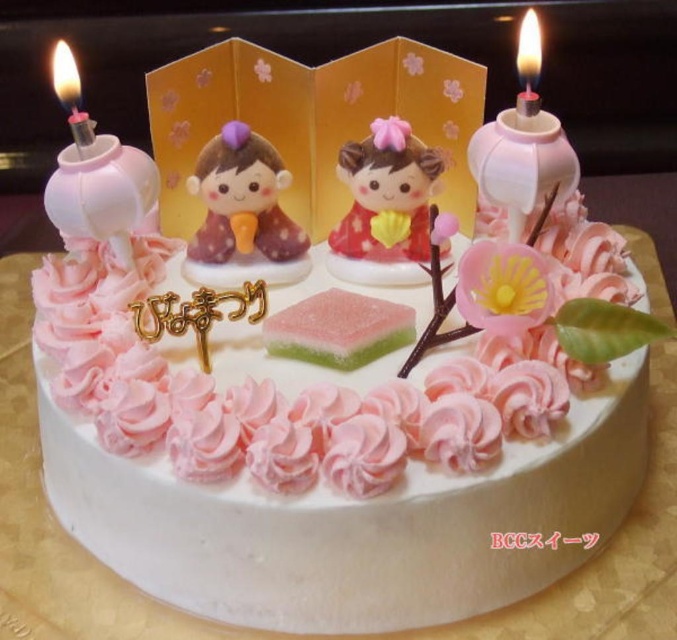
Consider the image. Where is the matte brown figurine at center located on the cake?

The matte brown figurine at center is located at point (242, 200) on the cake.

You are a guest at a Japanese festival and see the cake with the matte brown figurine at center and the matte pink clay doll at center. Which decoration is taller?

The matte pink clay doll at center is taller than the matte brown figurine at center.

You are a guest at a Japanese festival celebration. You see the translucent white candle at left and the translucent glass candle at upper right on the cake. Which candle is closer to you?

The translucent white candle at left is closer to you because it is in front of the translucent glass candle at upper right.